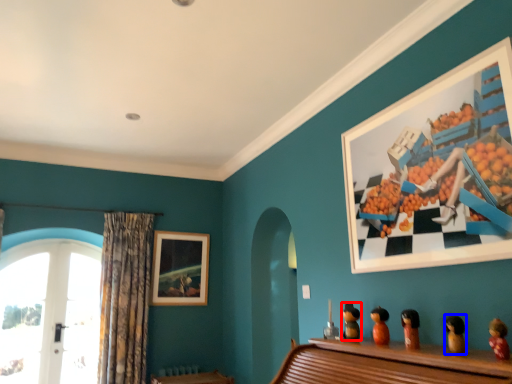
Question: Which object is closer to the camera taking this photo, toy (highlighted by a red box) or toy (highlighted by a blue box)?

Choices:
 (A) toy
 (B) toy

Answer: (B)